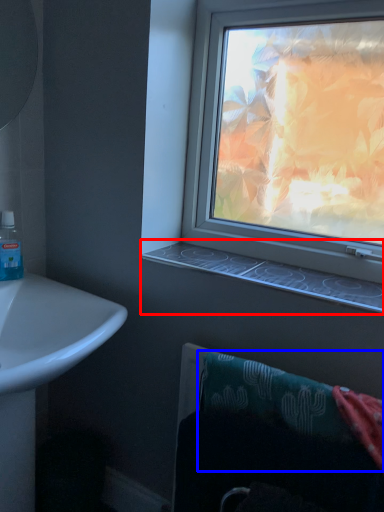
Question: Which object is closer to the camera taking this photo, window sill (highlighted by a red box) or bath towel (highlighted by a blue box)?

Choices:
 (A) window sill
 (B) bath towel

Answer: (B)